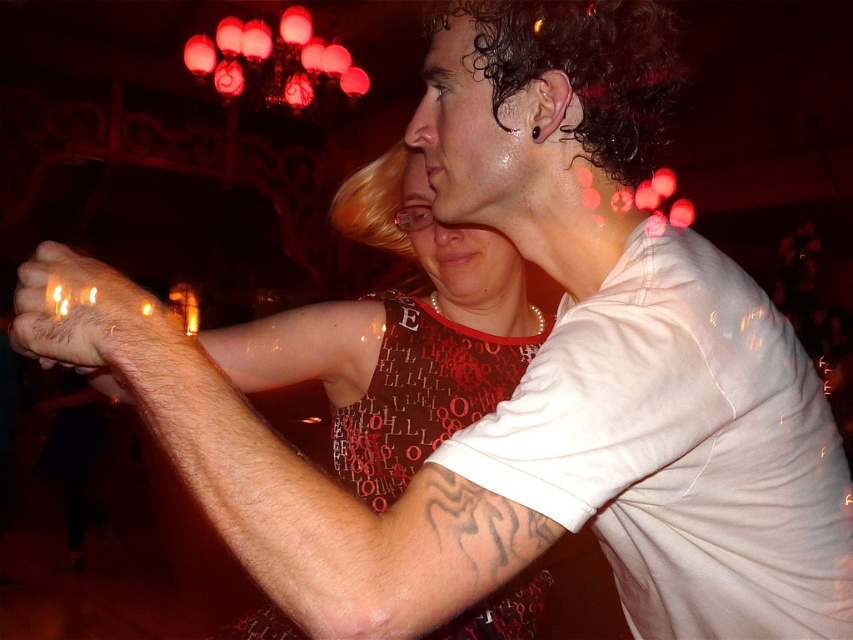
Question: In this image, where is hair at center located relative to hairy skin at center?

Choices:
 (A) right
 (B) left

Answer: (A)

Question: In this image, where is hair at center located relative to hairy skin at center?

Choices:
 (A) right
 (B) left

Answer: (A)

Question: Can you confirm if hair at center is positioned to the left of hairy skin at center?

Choices:
 (A) yes
 (B) no

Answer: (B)

Question: Which point is farther to the camera?

Choices:
 (A) hairy skin at center
 (B) hair at center

Answer: (A)

Question: Among these points, which one is farthest from the camera?

Choices:
 (A) (254, 387)
 (B) (148, 301)

Answer: (A)